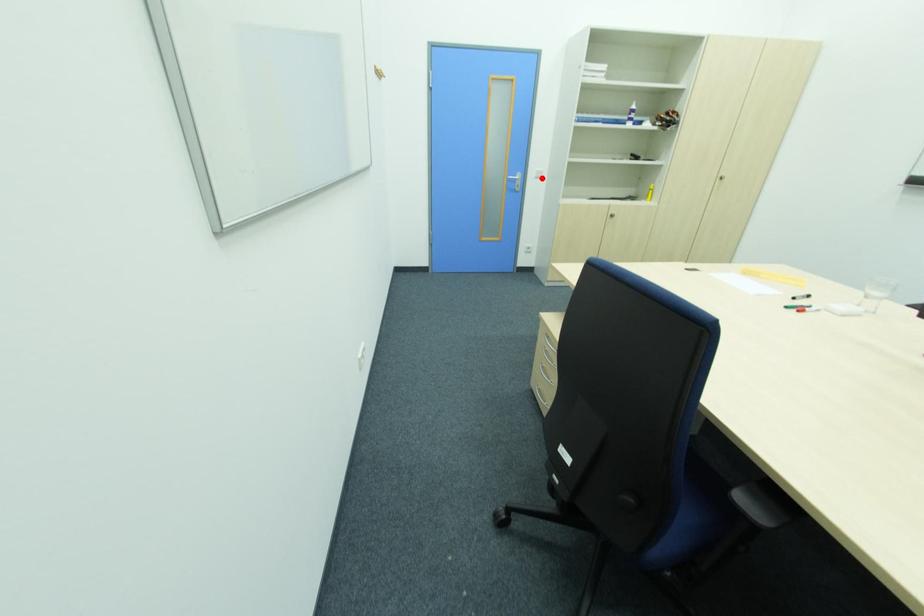
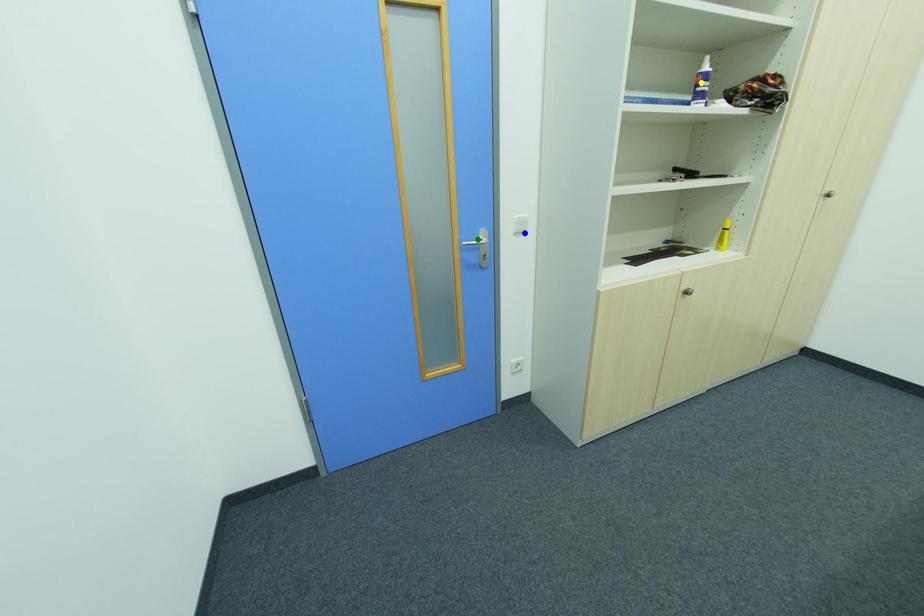
Question: I am providing you with two images of the same scene from different viewpoints. A red point is marked on the first image. You are given multiple points on the second image. In image 2, which mark is for the same physical point as the one in image 1?

Choices:
 (A) green point
 (B) blue point
 (C) yellow point

Answer: (B)